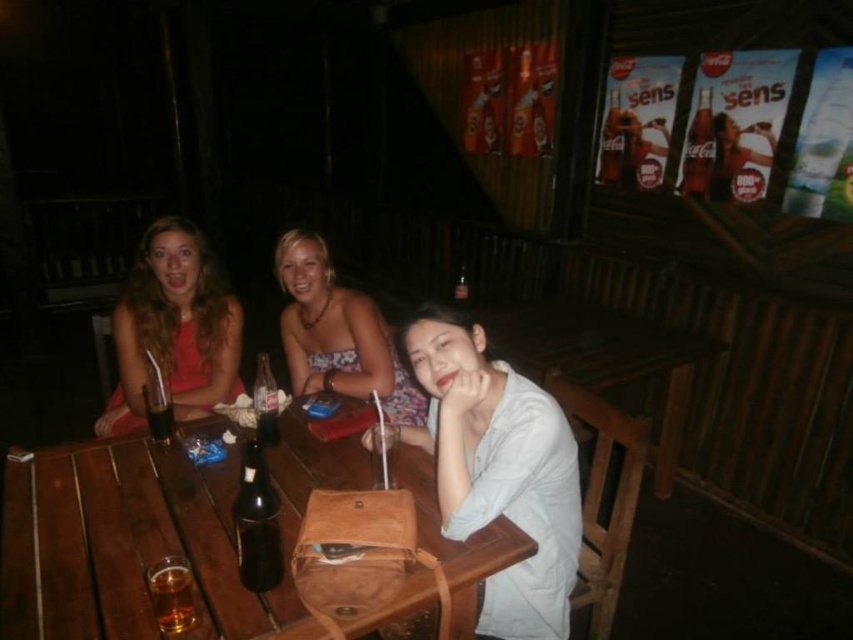
Is matte brown bag at center taller than matte red dress at left?

Indeed, matte brown bag at center has a greater height compared to matte red dress at left.

Does matte brown bag at center have a smaller size compared to matte red dress at left?

Yes.

At what (x,y) coordinates should I click in order to perform the action: click on matte brown bag at center. Please return your answer as a coordinate pair (x, y). The height and width of the screenshot is (640, 853). Looking at the image, I should click on (498, 468).

Locate an element on the screen. The width and height of the screenshot is (853, 640). matte brown bag at center is located at coordinates (498, 468).

Can you confirm if floral fabric dress at center is smaller than dark glass bottle at table center?

No, floral fabric dress at center is not smaller than dark glass bottle at table center.

Who is more distant from viewer, (x=381, y=394) or (x=155, y=436)?

Positioned behind is point (x=381, y=394).

What are the coordinates of `floral fabric dress at center` in the screenshot? It's located at pos(337,333).

Which is above, matte red dress at left or dark glass bottle at table center?

Positioned higher is matte red dress at left.

Can you confirm if matte red dress at left is taller than dark glass bottle at table center?

Indeed, matte red dress at left has a greater height compared to dark glass bottle at table center.

Is point (178, 228) positioned in front of point (148, 403)?

No, (178, 228) is behind (148, 403).

Identify the location of matte red dress at left. The height and width of the screenshot is (640, 853). (173, 328).